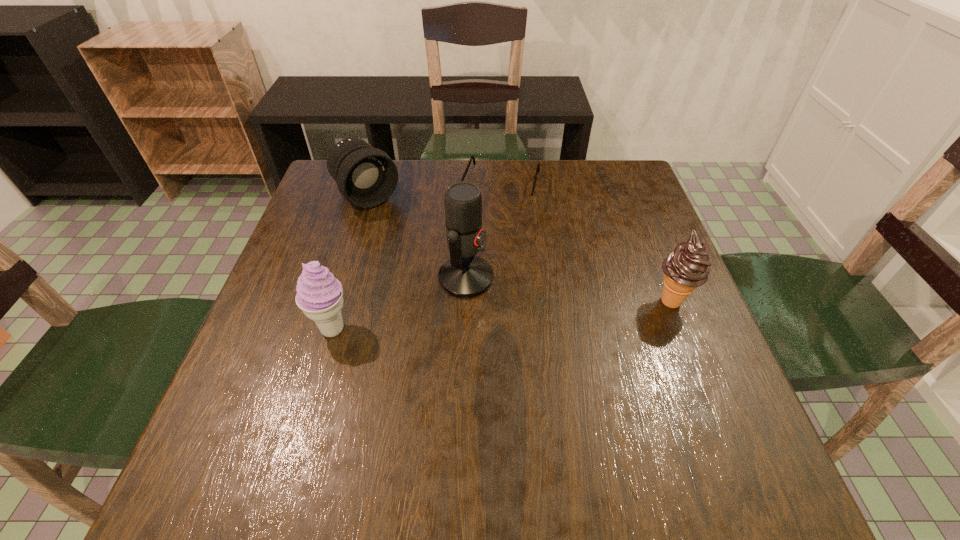
The width and height of the screenshot is (960, 540). I want to click on vacant point that satisfies the following two spatial constraints: 1. on the front side of the rightmost object; 2. on the right side of the shortest object, so click(x=507, y=301).

The width and height of the screenshot is (960, 540). In order to click on vacant point that satisfies the following two spatial constraints: 1. on the back side of the rightmost object; 2. on the right side of the left icecream in this screenshot , I will do `click(342, 301)`.

Locate an element on the screen. The width and height of the screenshot is (960, 540). blank area in the image that satisfies the following two spatial constraints: 1. on the back side of the left icecream; 2. on the right side of the tallest object is located at coordinates (348, 278).

Find the location of a particular element. free space that satisfies the following two spatial constraints: 1. on the front side of the spectacles; 2. on the left side of the rightmost object is located at coordinates (507, 301).

Where is `free point that satisfies the following two spatial constraints: 1. on the back side of the microphone; 2. on the right side of the shortest object`? Image resolution: width=960 pixels, height=540 pixels. free point that satisfies the following two spatial constraints: 1. on the back side of the microphone; 2. on the right side of the shortest object is located at coordinates (468, 189).